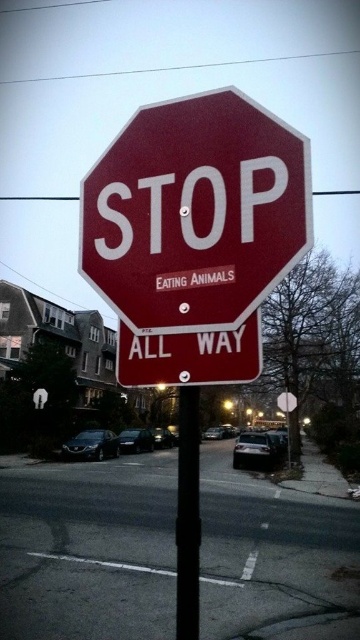
What is the coordinate of the smooth asphalt road at center?

The smooth asphalt road at center is located at coordinate point (88, 548).

What are the coordinates of the matte red stop sign at center?

The matte red stop sign at center is located at point (x=195, y=212).

You are a driver approaching the intersection and need to determine which object is taller between the smooth asphalt road at center and the black metal pole at center. Based on the scene, which one is taller?

The smooth asphalt road at center is taller than the black metal pole at center according to the description.